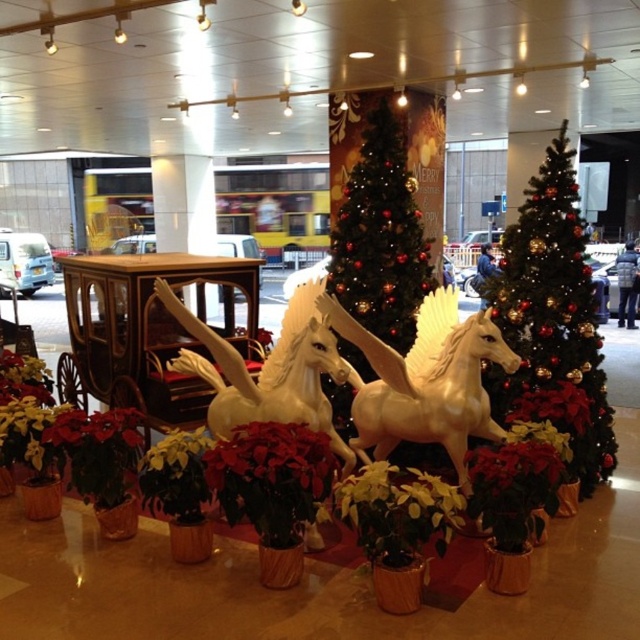
You are a delivery person who needs to move a large box through the space between the green glossy christmas tree at center and the wooden cart at center. The box is 1.2 meters wide. Can you fit the box through the space between them?

The green glossy christmas tree at center is smaller than the wooden cart at center, but the description does not provide the exact width of the space between them. Therefore, it is unclear if the box will fit.